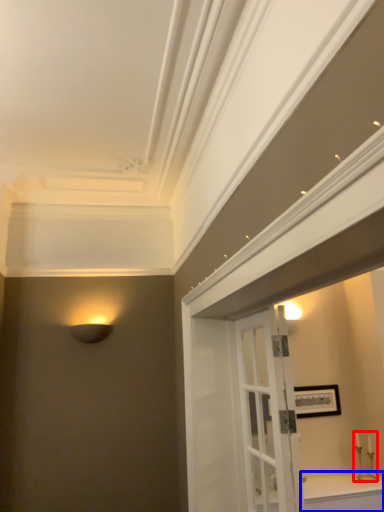
Question: Which object appears closest to the camera in this image, candle holder (highlighted by a red box) or cabinetry (highlighted by a blue box)?

Choices:
 (A) candle holder
 (B) cabinetry

Answer: (B)